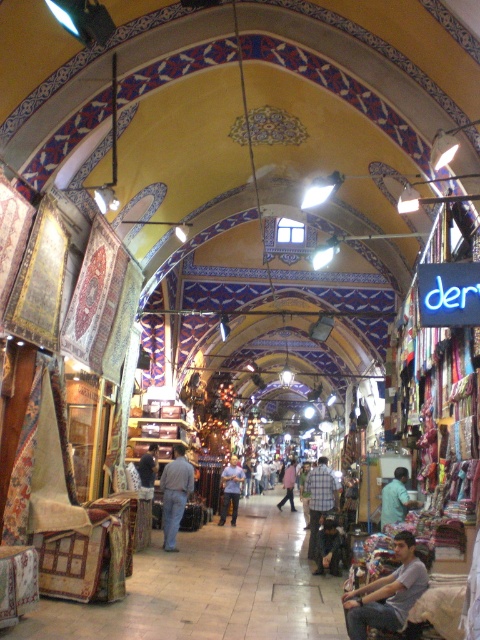
Does dark brown leather jacket at center appear on the right side of light blue shirt at center?

Yes, dark brown leather jacket at center is to the right of light blue shirt at center.

Which of these two, dark brown leather jacket at center or light blue shirt at center, stands taller?

Standing taller between the two is light blue shirt at center.

Is point (323, 570) positioned after point (238, 468)?

No, (323, 570) is closer to viewer.

Where is `dark brown leather jacket at center`? Image resolution: width=480 pixels, height=640 pixels. dark brown leather jacket at center is located at coordinates (328, 547).

Does plaid shirt at center appear on the right side of light blue fabric at center?

Incorrect, plaid shirt at center is not on the right side of light blue fabric at center.

Which is below, plaid shirt at center or light blue fabric at center?

plaid shirt at center is below.

Locate an element on the screen. The width and height of the screenshot is (480, 640). plaid shirt at center is located at coordinates (320, 499).

The width and height of the screenshot is (480, 640). Describe the element at coordinates (175, 493) in the screenshot. I see `blue jeans at center` at that location.

Does blue jeans at center have a greater width compared to light pink fabric at center?

In fact, blue jeans at center might be narrower than light pink fabric at center.

Is point (182, 452) more distant than point (284, 502)?

No, it is in front of (284, 502).

Identify the location of blue jeans at center. This screenshot has width=480, height=640. point(175,493).